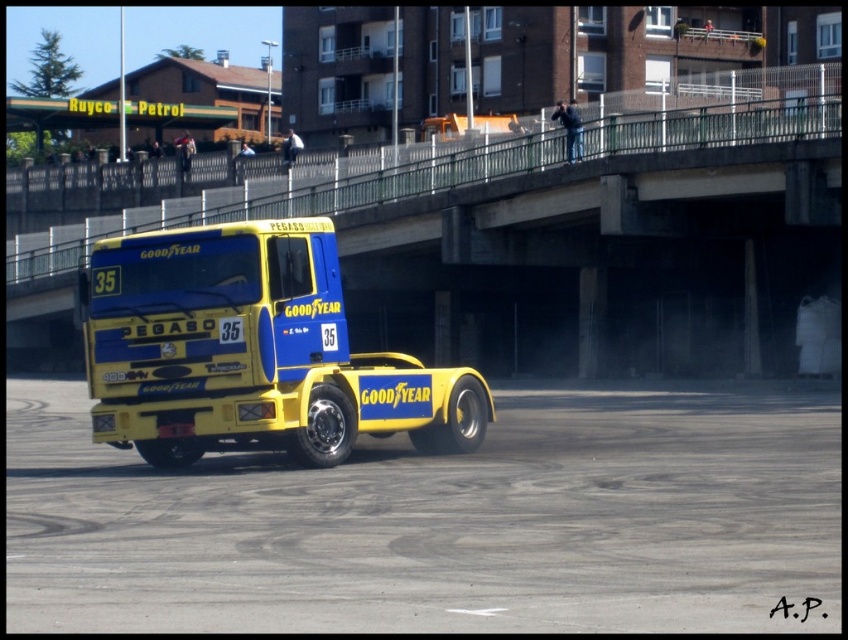
You are a photographer trying to capture the yellow matte truck at center from the yellow rubber dirt track at center. Which direction should you move to get a clear shot of the truck?

The yellow rubber dirt track at center is on the left side of the yellow matte truck at center, so you should move to the right side of the truck to get a clear shot.

You are standing at the position of point (174, 276) and want to walk to the vintage Pegaso truck. Which direction should you go relative to point (500, 588)?

You should walk towards point (500, 588) because it is in front of point (174, 276), meaning the truck is located in that direction.